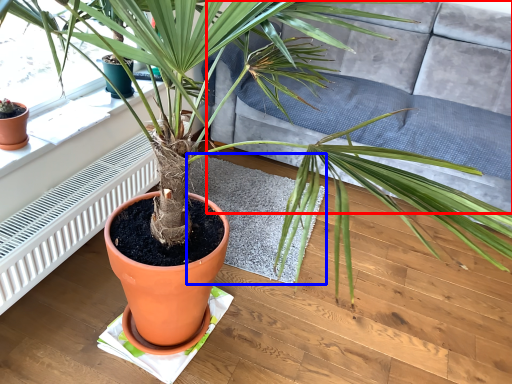
Question: Which point is closer to the camera, couch (highlighted by a red box) or mat (highlighted by a blue box)?

Choices:
 (A) couch
 (B) mat

Answer: (A)